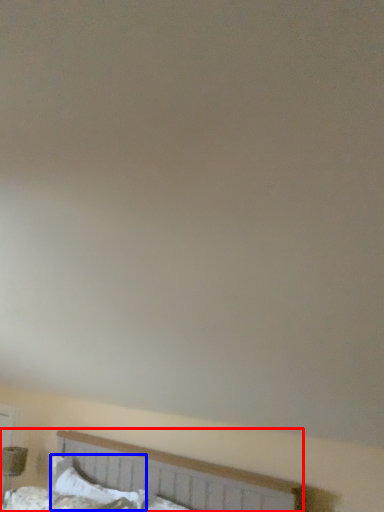
Question: Among these objects, which one is nearest to the camera, bed (highlighted by a red box) or pillow (highlighted by a blue box)?

Choices:
 (A) bed
 (B) pillow

Answer: (A)